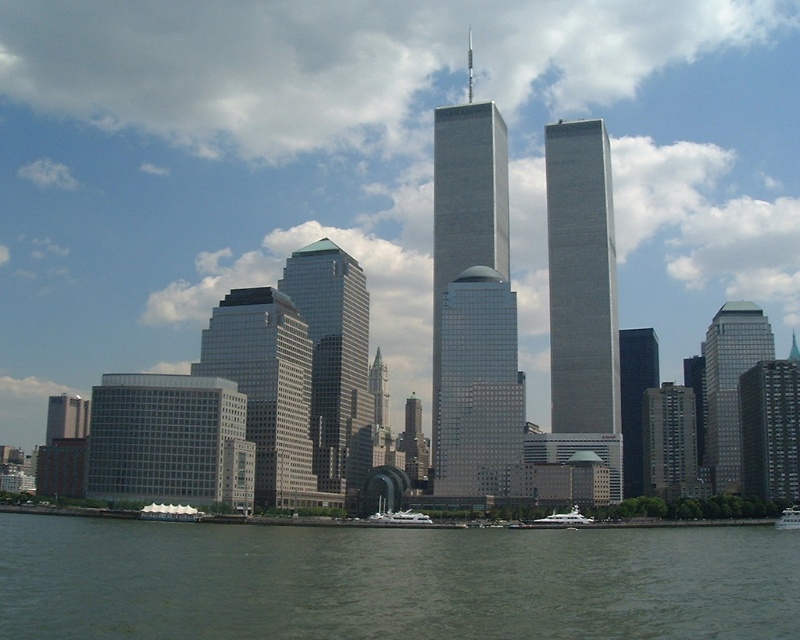
You are an architect evaluating the city skyline. You notice the matte glass skyscraper at center and the dark glass skyscraper at center. Which one has a greater height?

The matte glass skyscraper at center is taller than the dark glass skyscraper at center, so it has a greater height.

You are an architect designing a new bridge that needs to allow boats to pass underneath. You observe the white glossy yacht at lower center and the white glossy boat at lower right in the image. Which boat requires the bridge to have a taller clearance?

The white glossy boat at lower right requires the bridge to have a taller clearance because it is taller than the white glossy yacht at lower center.